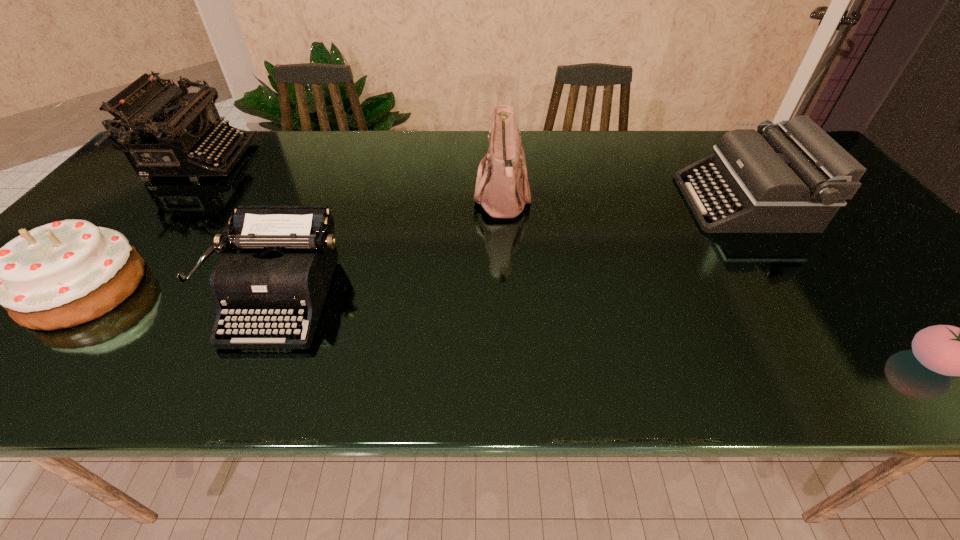
This screenshot has width=960, height=540. I want to click on free location located on the typing side of the rightmost typewriter, so click(x=582, y=202).

At what (x,y) coordinates should I click in order to perform the action: click on free space located 0.170m on the typing side of the rightmost typewriter. Please return your answer as a coordinate pair (x, y). The height and width of the screenshot is (540, 960). Looking at the image, I should click on (623, 202).

At what (x,y) coordinates should I click in order to perform the action: click on vacant space located 0.080m on the typing side of the shortest typewriter. Please return your answer as a coordinate pair (x, y). This screenshot has height=540, width=960. Looking at the image, I should click on (242, 389).

The height and width of the screenshot is (540, 960). I want to click on shoulder bag located in the far edge section of the desktop, so click(x=503, y=190).

This screenshot has height=540, width=960. I want to click on object situated at the near edge, so click(288, 254).

Find the location of a particular element. object positioned at the left edge is located at coordinates (164, 131).

Identify the location of object situated at the right edge. Image resolution: width=960 pixels, height=540 pixels. (793, 178).

Find the location of a particular element. object that is at the far left corner is located at coordinates (164, 131).

Image resolution: width=960 pixels, height=540 pixels. Find the location of `object located at the far right corner`. object located at the far right corner is located at coordinates (793, 178).

The height and width of the screenshot is (540, 960). In the image, there is a desktop. Find the location of `vacant region at the far edge`. vacant region at the far edge is located at coordinates (694, 134).